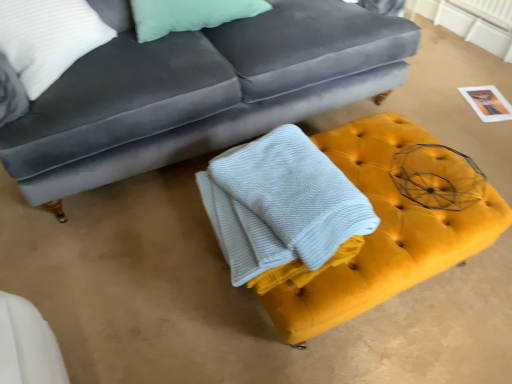
Question: Is velvet gray couch at upper center next to white textured bath towel at center?

Choices:
 (A) no
 (B) yes

Answer: (A)

Question: Is velvet gray couch at upper center outside white textured bath towel at center?

Choices:
 (A) yes
 (B) no

Answer: (A)

Question: Is white textured bath towel at center completely or partially inside velvet gray couch at upper center?

Choices:
 (A) no
 (B) yes

Answer: (A)

Question: Are velvet gray couch at upper center and white textured bath towel at center located far from each other?

Choices:
 (A) yes
 (B) no

Answer: (B)

Question: Does velvet gray couch at upper center appear on the left side of white textured bath towel at center?

Choices:
 (A) yes
 (B) no

Answer: (A)

Question: Considering the relative sizes of velvet gray couch at upper center and white textured bath towel at center in the image provided, is velvet gray couch at upper center bigger than white textured bath towel at center?

Choices:
 (A) no
 (B) yes

Answer: (B)

Question: From a real-world perspective, does yellow velvet ottoman at center stand above velvet gray couch at upper center?

Choices:
 (A) no
 (B) yes

Answer: (A)

Question: Is yellow velvet ottoman at center outside velvet gray couch at upper center?

Choices:
 (A) yes
 (B) no

Answer: (A)

Question: Considering the relative sizes of yellow velvet ottoman at center and velvet gray couch at upper center in the image provided, is yellow velvet ottoman at center smaller than velvet gray couch at upper center?

Choices:
 (A) no
 (B) yes

Answer: (B)

Question: Considering the relative sizes of yellow velvet ottoman at center and velvet gray couch at upper center in the image provided, is yellow velvet ottoman at center wider than velvet gray couch at upper center?

Choices:
 (A) yes
 (B) no

Answer: (B)

Question: Is yellow velvet ottoman at center thinner than velvet gray couch at upper center?

Choices:
 (A) no
 (B) yes

Answer: (B)

Question: Considering the relative positions of yellow velvet ottoman at center and velvet gray couch at upper center in the image provided, is yellow velvet ottoman at center in front of velvet gray couch at upper center?

Choices:
 (A) no
 (B) yes

Answer: (B)

Question: From the image's perspective, is velvet gray couch at upper center above yellow velvet ottoman at center?

Choices:
 (A) no
 (B) yes

Answer: (B)